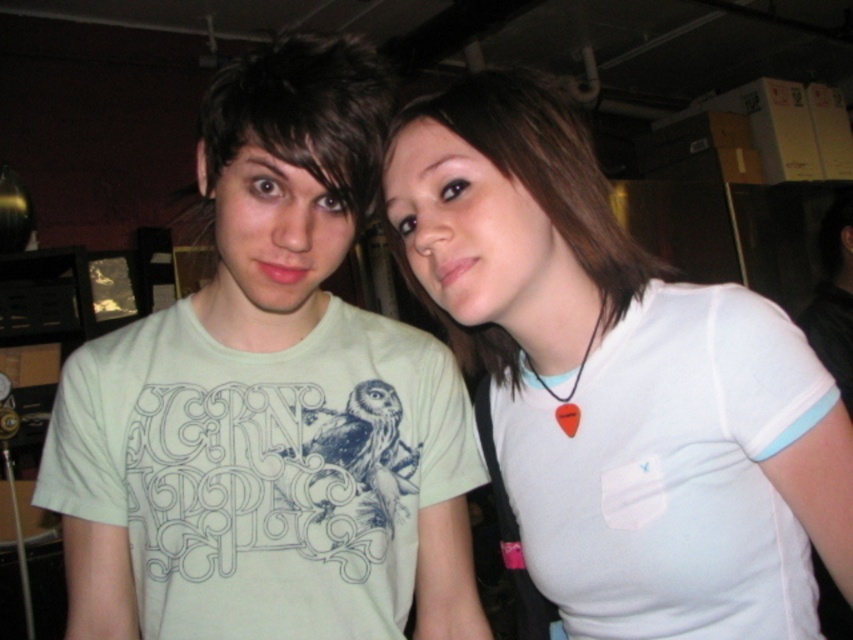
How distant is light green t-shirt at center from white matte shirt at center?

light green t-shirt at center and white matte shirt at center are 5.97 inches apart from each other.

Is light green t-shirt at center smaller than white matte shirt at center?

Actually, light green t-shirt at center might be larger than white matte shirt at center.

The height and width of the screenshot is (640, 853). I want to click on light green t-shirt at center, so click(x=270, y=404).